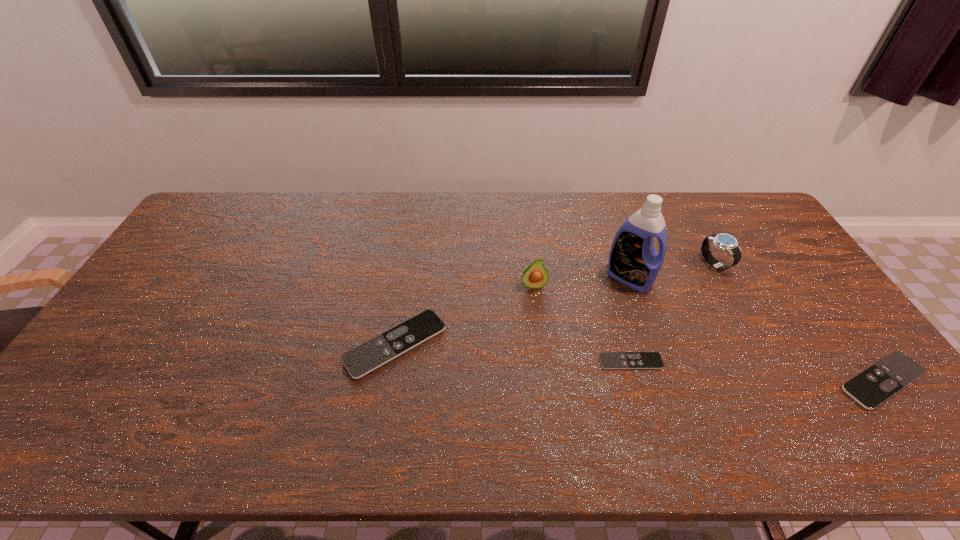
Image resolution: width=960 pixels, height=540 pixels. In the image, there is a desktop. Identify the location of vacant area at the right edge. (811, 304).

In order to click on vacant space at the far left corner in this screenshot , I will do `click(199, 226)`.

Locate an element on the screen. The height and width of the screenshot is (540, 960). free space between the leftmost object and the detergent is located at coordinates (513, 311).

In order to click on unoccupied area between the fifth tallest object and the shortest object in this screenshot , I will do `click(756, 371)`.

I want to click on vacant area that lies between the tallest object and the shortest remote control, so click(x=630, y=320).

The height and width of the screenshot is (540, 960). What are the coordinates of `free space between the second tallest remote control and the fourth shortest object` in the screenshot? It's located at point(799,322).

The width and height of the screenshot is (960, 540). Find the location of `free spot between the shortest remote control and the second object from left to right`. free spot between the shortest remote control and the second object from left to right is located at coordinates (582, 323).

Identify the location of empty space that is in between the watch and the detergent. The image size is (960, 540). (672, 271).

You are a GUI agent. You are given a task and a screenshot of the screen. Output one action in this format:
    pyautogui.click(x=<x>, y=<y>)
    Task: Click on the vacant region between the fifth tallest object and the tallest object
    Image resolution: width=960 pixels, height=540 pixels.
    Given the screenshot: What is the action you would take?
    pyautogui.click(x=756, y=329)

This screenshot has width=960, height=540. Identify the location of object that ranks as the fourth closest to the shortest object. (365, 358).